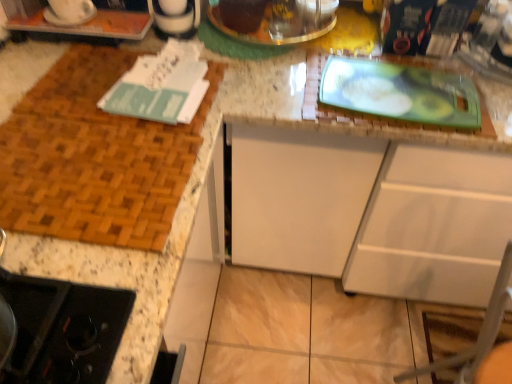
Question: Is point (464, 190) closer or farther from the camera than point (80, 21)?

Choices:
 (A) farther
 (B) closer

Answer: (B)

Question: Is white matte cabinet at center situated inside white glossy coffee maker at upper left, the 2th appliance positioned from the right, or outside?

Choices:
 (A) inside
 (B) outside

Answer: (B)

Question: Which of these objects is positioned closest to the white glossy coffee maker at upper left, acting as the 1th appliance starting from the left?

Choices:
 (A) white matte cabinet at center
 (B) metallic silver pot at upper center, placed as the 1th appliance when sorted from back to front

Answer: (B)

Question: Based on their relative distances, which object is nearer to the white glossy coffee maker at upper left, placed as the first appliance when sorted from front to back?

Choices:
 (A) white matte cabinet at center
 (B) metallic silver pot at upper center, arranged as the second appliance when viewed from the left

Answer: (B)